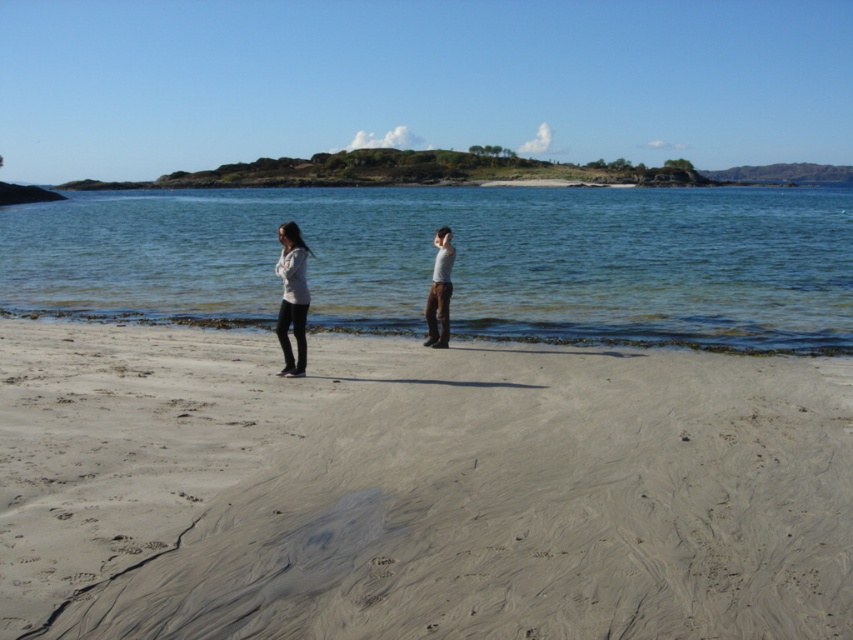
Question: Does smooth sand at center have a larger size compared to light gray cotton shirt at center?

Choices:
 (A) yes
 (B) no

Answer: (A)

Question: Considering the relative positions of clear water at center and matte gray sweater at center in the image provided, where is clear water at center located with respect to matte gray sweater at center?

Choices:
 (A) above
 (B) below

Answer: (A)

Question: Which object appears farthest from the camera in this image?

Choices:
 (A) smooth sand at center
 (B) light gray cotton shirt at center
 (C) clear water at center
 (D) matte gray sweater at center

Answer: (B)

Question: Which point is closer to the camera taking this photo?

Choices:
 (A) (296, 292)
 (B) (206, 595)
 (C) (436, 323)

Answer: (B)

Question: Which point appears closest to the camera in this image?

Choices:
 (A) (314, 637)
 (B) (126, 252)
 (C) (283, 372)
 (D) (440, 308)

Answer: (A)

Question: Does clear water at center have a greater width compared to light gray cotton shirt at center?

Choices:
 (A) no
 (B) yes

Answer: (B)